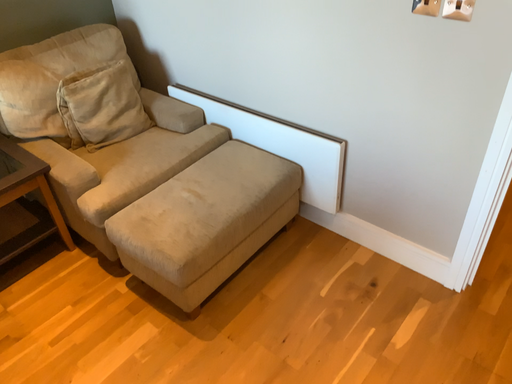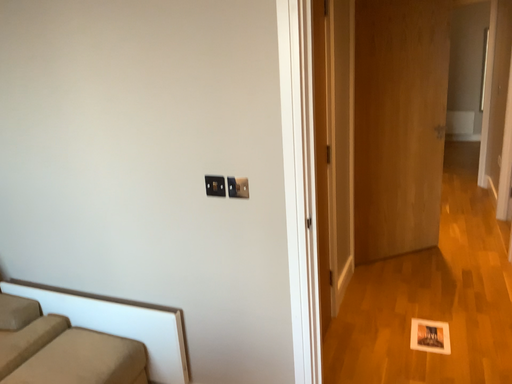
Question: How did the camera likely rotate when shooting the video?

Choices:
 (A) rotated upward
 (B) rotated downward

Answer: (A)